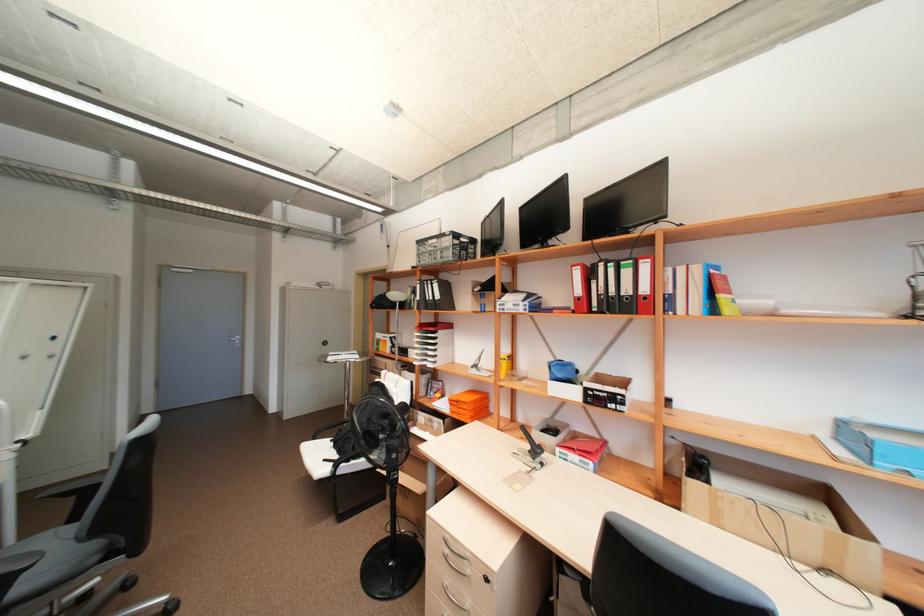
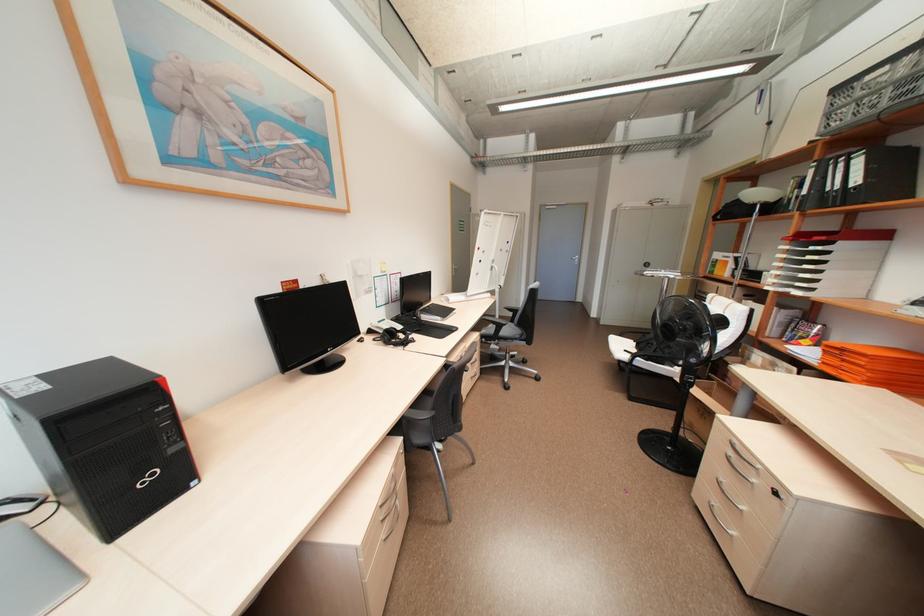
In the second image, find the point that corresponds to [423,297] in the first image.

(810, 191)